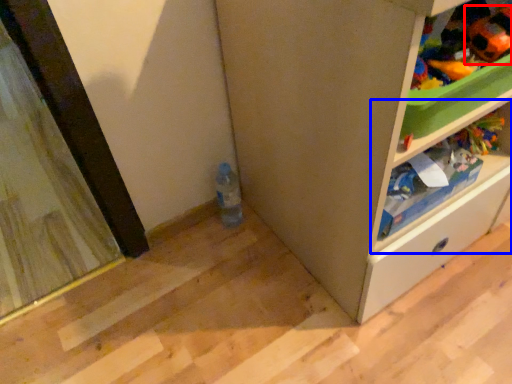
Question: Which point is further to the camera, toy (highlighted by a red box) or shelf (highlighted by a blue box)?

Choices:
 (A) toy
 (B) shelf

Answer: (B)